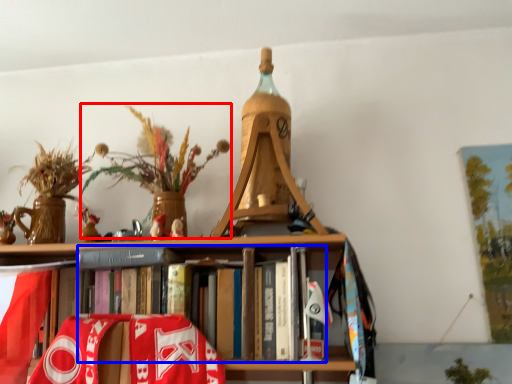
Question: Among these objects, which one is nearest to the camera, floral arrangement (highlighted by a red box) or book (highlighted by a blue box)?

Choices:
 (A) floral arrangement
 (B) book

Answer: (B)